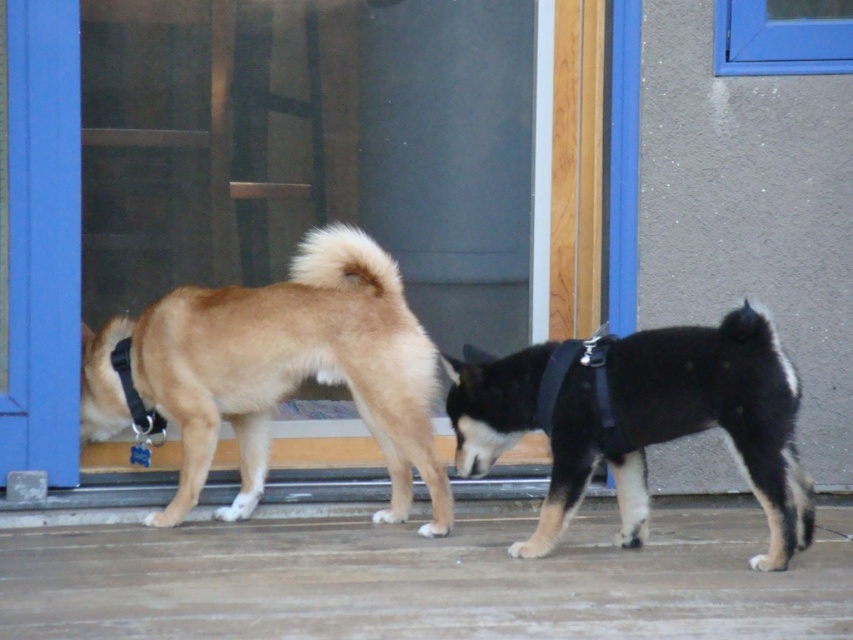
Question: Among these objects, which one is farthest from the camera?

Choices:
 (A) black matte dog at center
 (B) light brown fur at left

Answer: (B)

Question: Does light brown fur at left appear on the left side of black matte dog at center?

Choices:
 (A) yes
 (B) no

Answer: (A)

Question: Is light brown fur at left below black matte dog at center?

Choices:
 (A) yes
 (B) no

Answer: (B)

Question: Which point appears closest to the camera in this image?

Choices:
 (A) (256, 444)
 (B) (775, 460)

Answer: (B)

Question: In this image, where is light brown fur at left located relative to black matte dog at center?

Choices:
 (A) left
 (B) right

Answer: (A)